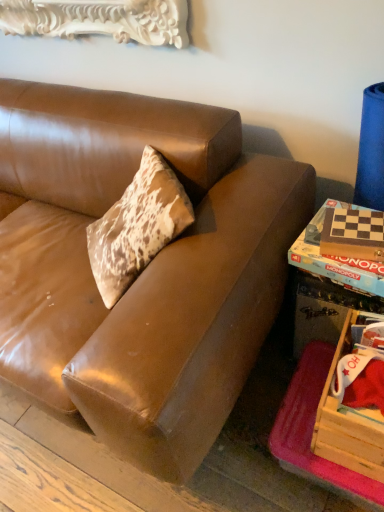
Question: Would you say brown leather couch at center is outside wooden monopoly game at right, placed as the second book when sorted from front to back?

Choices:
 (A) no
 (B) yes

Answer: (B)

Question: Would you say brown leather couch at center contains wooden monopoly game at right, placed as the second book when sorted from front to back?

Choices:
 (A) no
 (B) yes

Answer: (A)

Question: From the image's perspective, is brown leather couch at center beneath wooden monopoly game at right, placed as the first book when sorted from back to front?

Choices:
 (A) no
 (B) yes

Answer: (A)

Question: Could you tell me if brown leather couch at center is turned towards wooden monopoly game at right, placed as the second book when sorted from front to back?

Choices:
 (A) yes
 (B) no

Answer: (B)

Question: Does brown leather couch at center have a greater width compared to wooden monopoly game at right, placed as the second book when sorted from front to back?

Choices:
 (A) yes
 (B) no

Answer: (A)

Question: Is brown leather couch at center positioned behind wooden monopoly game at right, placed as the first book when sorted from back to front?

Choices:
 (A) yes
 (B) no

Answer: (B)

Question: Is wooden crate at lower right further to camera compared to wooden monopoly game at right, placed as the first book when sorted from back to front?

Choices:
 (A) yes
 (B) no

Answer: (B)

Question: Is wooden monopoly game at right, placed as the second book when sorted from front to back, surrounded by wooden crate at lower right?

Choices:
 (A) no
 (B) yes

Answer: (A)

Question: Does wooden crate at lower right have a smaller size compared to wooden monopoly game at right, placed as the first book when sorted from back to front?

Choices:
 (A) no
 (B) yes

Answer: (A)

Question: From a real-world perspective, is wooden crate at lower right on wooden monopoly game at right, placed as the first book when sorted from back to front?

Choices:
 (A) no
 (B) yes

Answer: (A)

Question: Is the depth of wooden crate at lower right less than that of wooden monopoly game at right, placed as the first book when sorted from back to front?

Choices:
 (A) no
 (B) yes

Answer: (B)

Question: Is wooden crate at lower right turned away from wooden monopoly game at right, placed as the second book when sorted from front to back?

Choices:
 (A) no
 (B) yes

Answer: (A)

Question: Considering the relative sizes of wooden monopoly game at right, placed as the first book when sorted from back to front, and wooden game board at lower right in the image provided, is wooden monopoly game at right, placed as the first book when sorted from back to front, shorter than wooden game board at lower right?

Choices:
 (A) no
 (B) yes

Answer: (B)